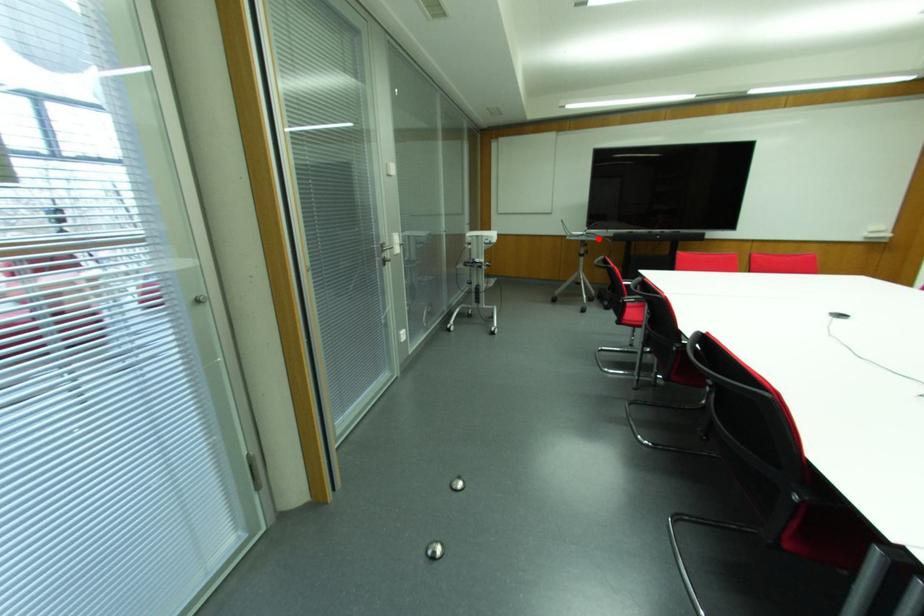
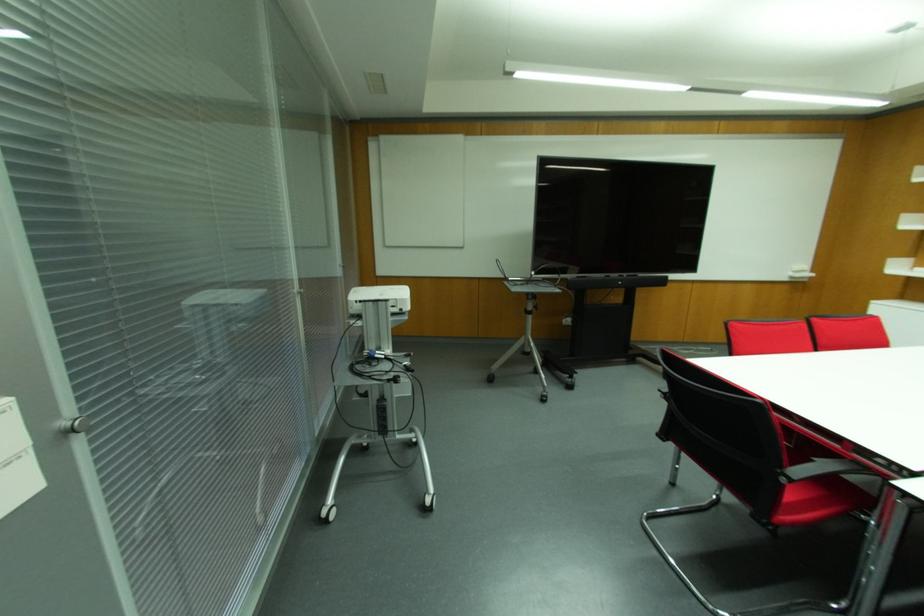
Question: I am providing you with two images of the same scene from different viewpoints. In image1, a red point is highlighted. Considering the same 3D point in image2, which of the following is correct?

Choices:
 (A) It is closer
 (B) It is farther

Answer: (B)